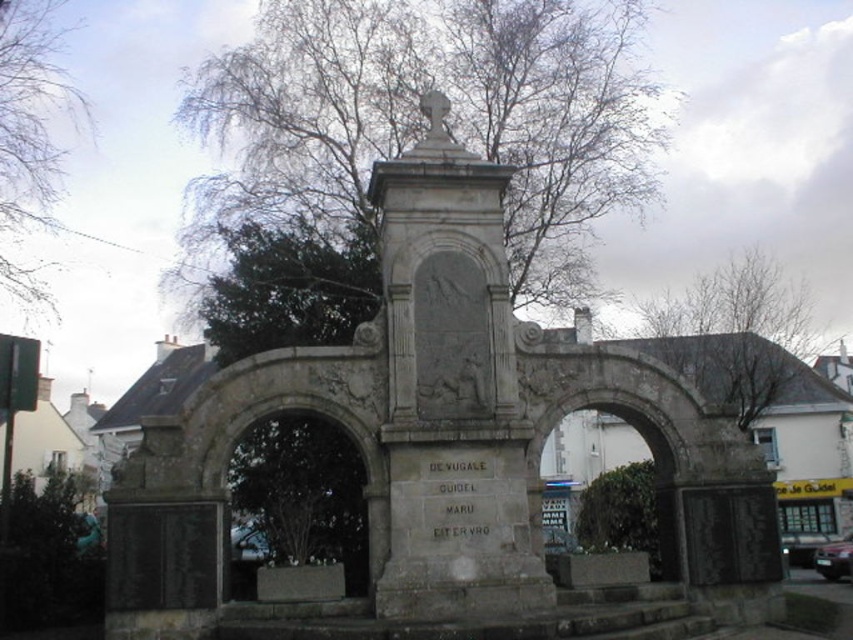
Question: Which object is positioned closest to the green leafy bush at center?

Choices:
 (A) stone monument at center
 (B) green leafy tree at upper center

Answer: (A)

Question: Among these objects, which one is farthest from the camera?

Choices:
 (A) green leafy bush at center
 (B) stone monument at center
 (C) bare branches at upper center

Answer: (A)

Question: Is green leafy tree at upper center behind green leafy bush at center?

Choices:
 (A) no
 (B) yes

Answer: (B)

Question: Is stone monument at center positioned before bare branches at upper left?

Choices:
 (A) yes
 (B) no

Answer: (A)

Question: Which of the following is the farthest from the observer?

Choices:
 (A) green leafy bush at center
 (B) green leafy tree at upper center
 (C) stone monument at center
 (D) bare branches at upper left

Answer: (D)

Question: Does bare branches at upper center have a greater width compared to green leafy bush at center?

Choices:
 (A) yes
 (B) no

Answer: (A)